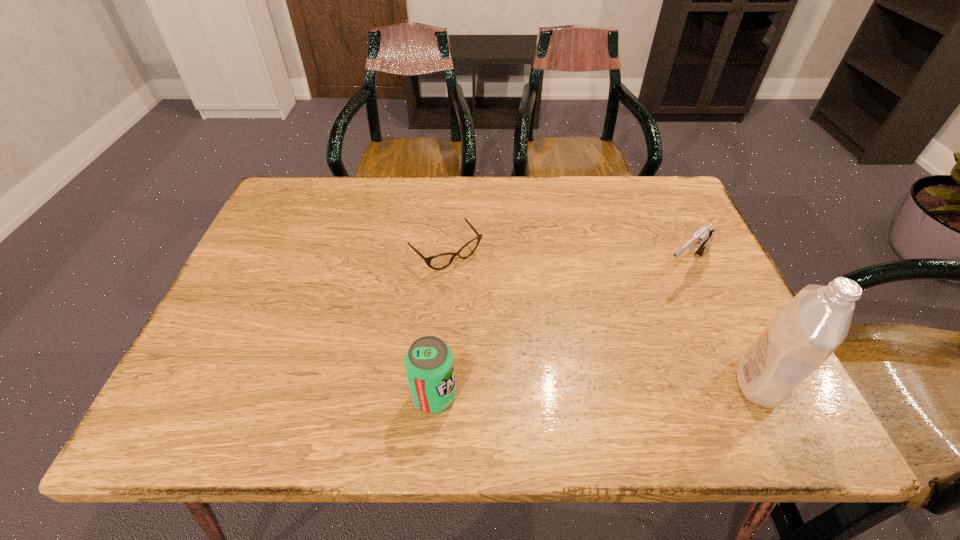
This screenshot has height=540, width=960. I want to click on free space on the desktop that is between the third shortest object and the detergent and is positioned on the front-facing side of the shortest object, so click(x=571, y=389).

Where is `vacant spot on the desktop that is between the pop soda and the tallest object and is positioned at the muzzle of the second shortest object`? Image resolution: width=960 pixels, height=540 pixels. vacant spot on the desktop that is between the pop soda and the tallest object and is positioned at the muzzle of the second shortest object is located at coordinates (554, 390).